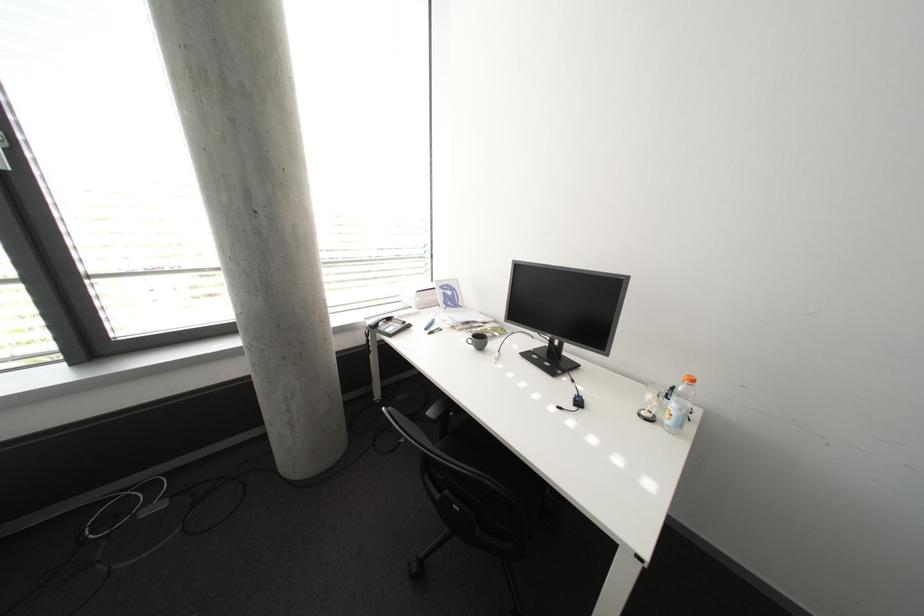
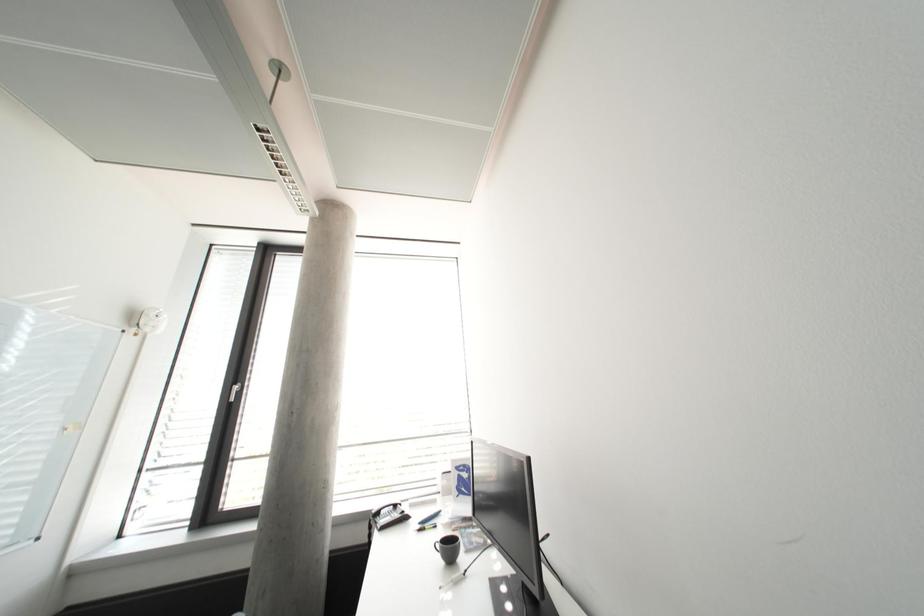
In the scene shown: How did the camera likely rotate?

The camera rotated toward left-up.